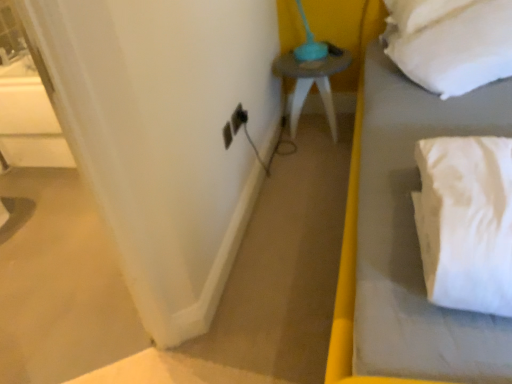
Find the location of `black plastic electric outlet at lower center`. black plastic electric outlet at lower center is located at coordinates (238, 118).

I want to click on matte gray side table at center, so point(311,83).

From the picture: Is white soft pillow at upper right next to white fabric curtain at left?

No, white soft pillow at upper right is not with white fabric curtain at left.

How many degrees apart are the facing directions of white soft pillow at upper right and white fabric curtain at left?

2.31 degrees separate the facing orientations of white soft pillow at upper right and white fabric curtain at left.

Which object is thinner, white soft pillow at upper right or white fabric curtain at left?

white fabric curtain at left.

Which object is positioned more to the left, matte gray side table at center or black plastic electric outlet at lower center?

From the viewer's perspective, black plastic electric outlet at lower center appears more on the left side.

Which object is wider, matte gray side table at center or black plastic electric outlet at lower center?

With larger width is matte gray side table at center.

This screenshot has height=384, width=512. In order to click on electric outlet on the left of matte gray side table at center in this screenshot , I will do `click(238, 118)`.

Consider the image. Which is nearer, (338, 68) or (231, 119)?

The point (231, 119) is in front.

Considering the points (150, 270) and (415, 4), which point is in front, point (150, 270) or point (415, 4)?

The point (150, 270) is more forward.

Considering the sizes of white fabric curtain at left and white soft pillow at upper right in the image, is white fabric curtain at left taller or shorter than white soft pillow at upper right?

Considering their sizes, white fabric curtain at left has more height than white soft pillow at upper right.

Is white fabric curtain at left not inside white soft pillow at upper right?

Yes.

Is white fabric curtain at left positioned far away from white soft pillow at upper right?

No.

What's the angular difference between black plastic electric outlet at lower center and white soft bed at right's facing directions?

The angular difference between black plastic electric outlet at lower center and white soft bed at right is 86.4 degrees.

Considering the points (237, 120) and (409, 301), which point is in front, point (237, 120) or point (409, 301)?

Point (409, 301)

From a real-world perspective, is black plastic electric outlet at lower center physically above white soft bed at right?

Yes, from a real-world perspective, black plastic electric outlet at lower center is over white soft bed at right

Who is smaller, black plastic electric outlet at lower center or white soft bed at right?

Smaller between the two is black plastic electric outlet at lower center.

Is there a large distance between matte gray side table at center and white soft bed at right?

matte gray side table at center is actually quite close to white soft bed at right.

From a real-world perspective, between matte gray side table at center and white soft bed at right, who is vertically lower?

matte gray side table at center, from a real-world perspective.

Considering the relative sizes of matte gray side table at center and white soft bed at right in the image provided, is matte gray side table at center smaller than white soft bed at right?

Yes, matte gray side table at center is smaller than white soft bed at right.

Considering the sizes of matte gray side table at center and white soft bed at right in the image, is matte gray side table at center wider or thinner than white soft bed at right?

In the image, matte gray side table at center appears to be more narrow than white soft bed at right.

This screenshot has height=384, width=512. Identify the location of curtain in front of the matte gray side table at center. (164, 135).

Is matte gray side table at center taller or shorter than white fabric curtain at left?

In the image, matte gray side table at center appears to be shorter than white fabric curtain at left.

Considering the sizes of matte gray side table at center and white fabric curtain at left in the image, is matte gray side table at center wider or thinner than white fabric curtain at left?

Clearly, matte gray side table at center has more width compared to white fabric curtain at left.

From a real-world perspective, does matte gray side table at center sit lower than white fabric curtain at left?

Yes, from a real-world perspective, matte gray side table at center is below white fabric curtain at left.

Which is further, (237, 122) or (478, 81)?

Point (237, 122)

Does black plastic electric outlet at lower center appear on the left side of white soft pillow at upper right?

Indeed, black plastic electric outlet at lower center is positioned on the left side of white soft pillow at upper right.

Find the location of a particular element. This screenshot has width=512, height=384. electric outlet behind the white soft pillow at upper right is located at coordinates (x=238, y=118).

You are a GUI agent. You are given a task and a screenshot of the screen. Output one action in this format:
    pyautogui.click(x=<x>, y=<y>)
    Task: Click on the curtain below the white soft pillow at upper right (from the image's perspective)
    
    Given the screenshot: What is the action you would take?
    pyautogui.click(x=164, y=135)

What are the coordinates of `electric outlet above the matte gray side table at center (from a real-world perspective)` in the screenshot? It's located at tap(238, 118).

Looking at this image, estimate the real-world distances between objects in this image. Which object is further from white fabric curtain at left, white soft bed at right or white soft pillow at upper right?

white soft pillow at upper right lies further to white fabric curtain at left than the other object.

Estimate the real-world distances between objects in this image. Which object is further from black plastic electric outlet at lower center, white fabric curtain at left or matte gray side table at center?

matte gray side table at center lies further to black plastic electric outlet at lower center than the other object.

Looking at the image, which one is located closer to white soft bed at right, white soft pillow at upper right or black plastic electric outlet at lower center?

white soft pillow at upper right is positioned closer to the anchor white soft bed at right.

Considering their positions, is matte gray side table at center positioned closer to white fabric curtain at left than white soft pillow at upper right?

white soft pillow at upper right.

In the scene shown: Which object lies further to the anchor point matte gray side table at center, white fabric curtain at left or white soft pillow at upper right?

white fabric curtain at left lies further to matte gray side table at center than the other object.

From the image, which object appears to be nearer to white soft pillow at upper right, white soft bed at right or matte gray side table at center?

white soft bed at right lies closer to white soft pillow at upper right than the other object.

Estimate the real-world distances between objects in this image. Which object is closer to black plastic electric outlet at lower center, white soft bed at right or white soft pillow at upper right?

white soft bed at right.

From the image, which object appears to be nearer to matte gray side table at center, white fabric curtain at left or black plastic electric outlet at lower center?

black plastic electric outlet at lower center is closer to matte gray side table at center.

Identify the location of curtain between white soft bed at right and black plastic electric outlet at lower center from front to back. (164, 135).

Identify the location of furniture situated between black plastic electric outlet at lower center and white soft pillow at upper right from left to right. (311, 83).

At what (x,y) coordinates should I click in order to perform the action: click on bed located between white fabric curtain at left and white soft pillow at upper right in the left-right direction. Please return your answer as a coordinate pair (x, y). The height and width of the screenshot is (384, 512). Looking at the image, I should click on (396, 225).

Locate an element on the screen. This screenshot has height=384, width=512. electric outlet situated between white fabric curtain at left and white soft pillow at upper right from left to right is located at coordinates (238, 118).